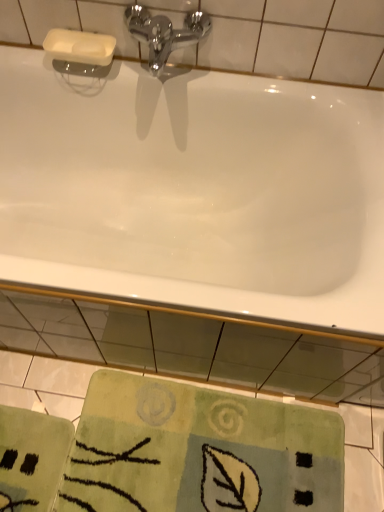
The height and width of the screenshot is (512, 384). Describe the element at coordinates (194, 191) in the screenshot. I see `white glossy bathtub at upper center` at that location.

This screenshot has width=384, height=512. I want to click on chrome metallic faucet at upper center, so click(x=165, y=33).

Locate an element on the screen. The height and width of the screenshot is (512, 384). white glossy bathtub at upper center is located at coordinates (194, 191).

Consider the image. Could you tell me if chrome metallic faucet at upper center is facing green textured rug at lower center?

No, chrome metallic faucet at upper center is not oriented towards green textured rug at lower center.

Which is further, (173, 50) or (312, 465)?

The point (312, 465) is more distant.

Find the location of a particular element. Image resolution: width=384 pixels, height=512 pixels. beach towel on the right side of chrome metallic faucet at upper center is located at coordinates (199, 451).

From a real-world perspective, who is located higher, chrome metallic faucet at upper center or green textured rug at lower center?

In real-world perspective, chrome metallic faucet at upper center is above.

How many degrees apart are the facing directions of white glossy bathtub at upper center and green textured rug at lower center?

They differ by 0.0928 degrees in their facing directions.

Are white glossy bathtub at upper center and green textured rug at lower center located far from each other?

No.

Choose the correct answer: Is white glossy bathtub at upper center inside green textured rug at lower center or outside it?

white glossy bathtub at upper center is outside green textured rug at lower center.

How distant is white glossy bathtub at upper center from green textured rug at lower center?

58.69 centimeters.

Is green textured rug at lower center aimed at chrome metallic faucet at upper center?

No, green textured rug at lower center is not turned towards chrome metallic faucet at upper center.

How many degrees apart are the facing directions of green textured rug at lower center and chrome metallic faucet at upper center?

They differ by 0.0501 degrees in their facing directions.

Which of these two, green textured rug at lower center or chrome metallic faucet at upper center, stands shorter?

green textured rug at lower center is shorter.

Is chrome metallic faucet at upper center not within white glossy bathtub at upper center?

Absolutely, chrome metallic faucet at upper center is external to white glossy bathtub at upper center.

Which is more to the right, chrome metallic faucet at upper center or white glossy bathtub at upper center?

chrome metallic faucet at upper center is more to the right.

Is point (161, 60) closer to camera compared to point (294, 192)?

Yes, point (161, 60) is in front of point (294, 192).

From the picture: From the image's perspective, is white glossy bathtub at upper center below chrome metallic faucet at upper center?

Indeed, from the image's perspective, white glossy bathtub at upper center is shown beneath chrome metallic faucet at upper center.

Does white glossy bathtub at upper center have a lesser width compared to chrome metallic faucet at upper center?

Incorrect, the width of white glossy bathtub at upper center is not less than that of chrome metallic faucet at upper center.

Looking at this image, considering the positions of objects white glossy bathtub at upper center and chrome metallic faucet at upper center in the image provided, who is more to the right, white glossy bathtub at upper center or chrome metallic faucet at upper center?

Positioned to the right is chrome metallic faucet at upper center.

Is green textured rug at lower center in contact with white glossy bathtub at upper center?

No, green textured rug at lower center is not with white glossy bathtub at upper center.

Based on the photo, between green textured rug at lower center and white glossy bathtub at upper center, which one has less height?

With less height is green textured rug at lower center.

From the image's perspective, which is below, green textured rug at lower center or white glossy bathtub at upper center?

green textured rug at lower center.

In the scene shown: From a real-world perspective, is green textured rug at lower center positioned above or below white glossy bathtub at upper center?

From a real-world perspective, green textured rug at lower center is physically below white glossy bathtub at upper center.

You are a GUI agent. You are given a task and a screenshot of the screen. Output one action in this format:
    pyautogui.click(x=<x>, y=<y>)
    Task: Click on the beach towel located behind the chrome metallic faucet at upper center
    
    Given the screenshot: What is the action you would take?
    pyautogui.click(x=199, y=451)

In the image, there is a green textured rug at lower center. What are the coordinates of `bathtub above it (from the image's perspective)` in the screenshot? It's located at (194, 191).

Based on their spatial positions, is chrome metallic faucet at upper center or green textured rug at lower center further from white glossy bathtub at upper center?

The object further to white glossy bathtub at upper center is green textured rug at lower center.

From the image, which object appears to be farther from white glossy bathtub at upper center, green textured rug at lower center or chrome metallic faucet at upper center?

Among the two, green textured rug at lower center is located further to white glossy bathtub at upper center.

In the scene shown: Estimate the real-world distances between objects in this image. Which object is closer to green textured rug at lower center, chrome metallic faucet at upper center or white glossy bathtub at upper center?

The object closer to green textured rug at lower center is white glossy bathtub at upper center.

From the picture: Looking at the image, which one is located closer to green textured rug at lower center, white glossy bathtub at upper center or chrome metallic faucet at upper center?

white glossy bathtub at upper center is closer to green textured rug at lower center.

From the image, which object appears to be farther from chrome metallic faucet at upper center, green textured rug at lower center or white glossy bathtub at upper center?

green textured rug at lower center.

In the scene shown: Considering their positions, is white glossy bathtub at upper center positioned closer to chrome metallic faucet at upper center than green textured rug at lower center?

Based on the image, white glossy bathtub at upper center appears to be nearer to chrome metallic faucet at upper center.

Locate an element on the screen. Image resolution: width=384 pixels, height=512 pixels. bathtub between chrome metallic faucet at upper center and green textured rug at lower center in the up-down direction is located at coordinates [x=194, y=191].